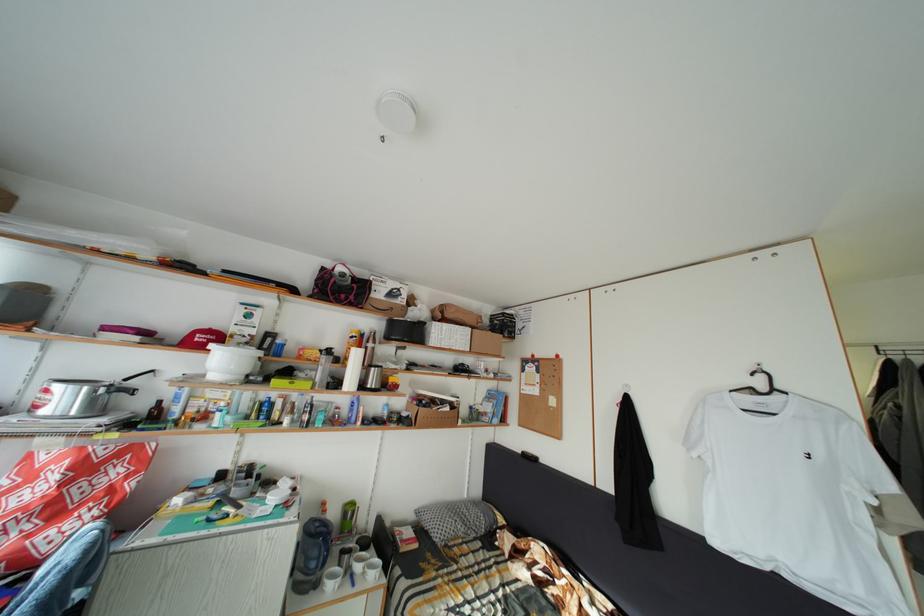
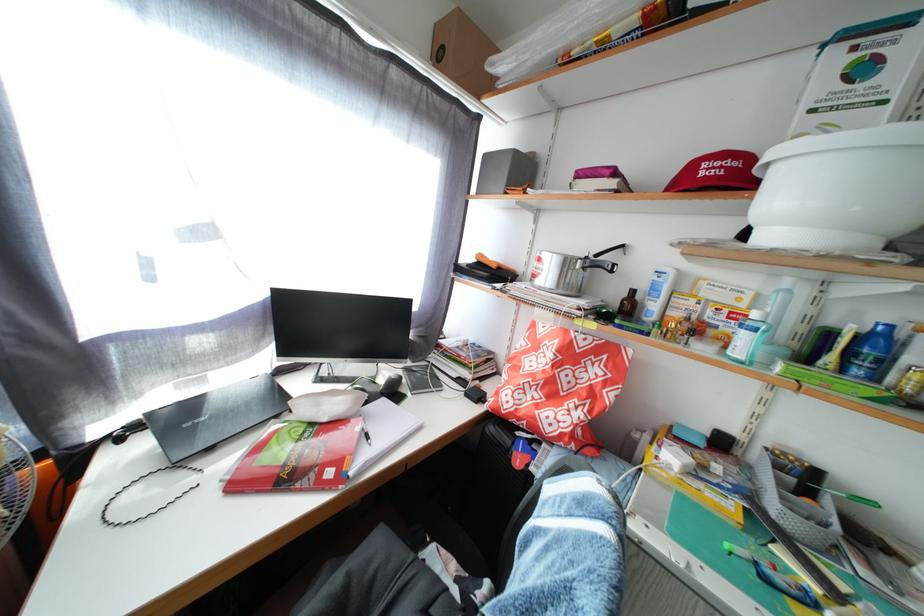
In the second image, find the point that corresponds to (x=217, y=342) in the first image.

(736, 169)